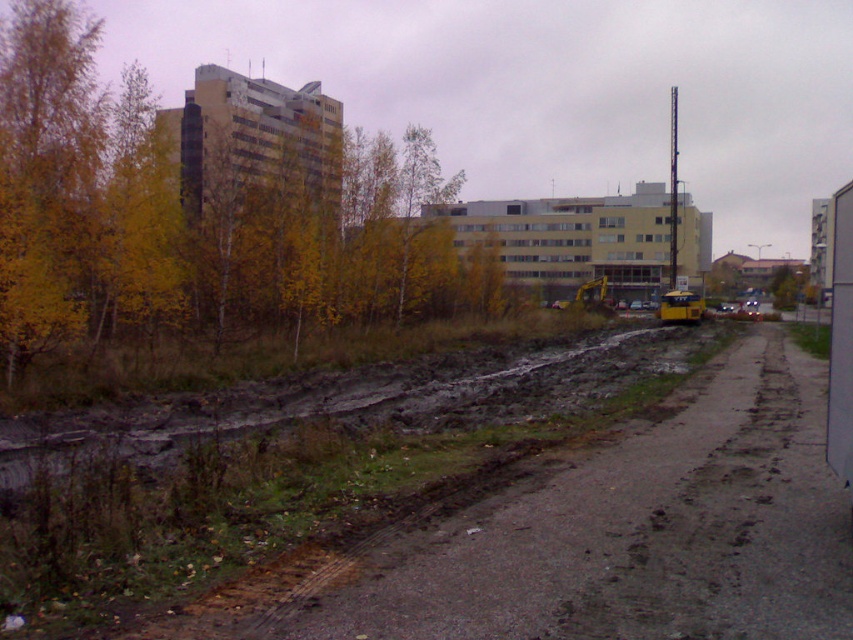
Question: Which of the following is the closest to the observer?

Choices:
 (A) muddy asphalt at lower left
 (B) yellow leafy trees at upper left

Answer: (A)

Question: Does yellow leafy trees at upper left appear over muddy asphalt at lower left?

Choices:
 (A) yes
 (B) no

Answer: (A)

Question: Is yellow leafy trees at upper left below muddy asphalt at lower left?

Choices:
 (A) yes
 (B) no

Answer: (B)

Question: Observing the image, what is the correct spatial positioning of yellow leafy trees at upper left in reference to muddy asphalt at lower left?

Choices:
 (A) below
 (B) above

Answer: (B)